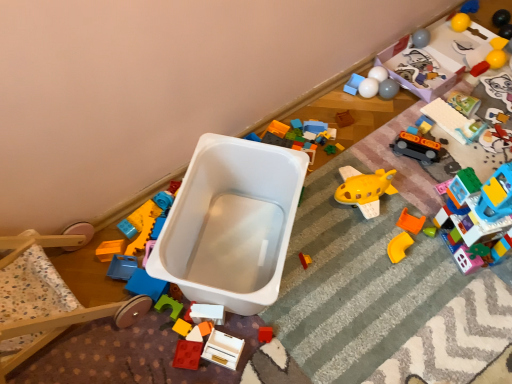
I want to click on free spot behind translucent plastic building blocks at right, positioned as the 12th toy in left-to-right order, so click(440, 171).